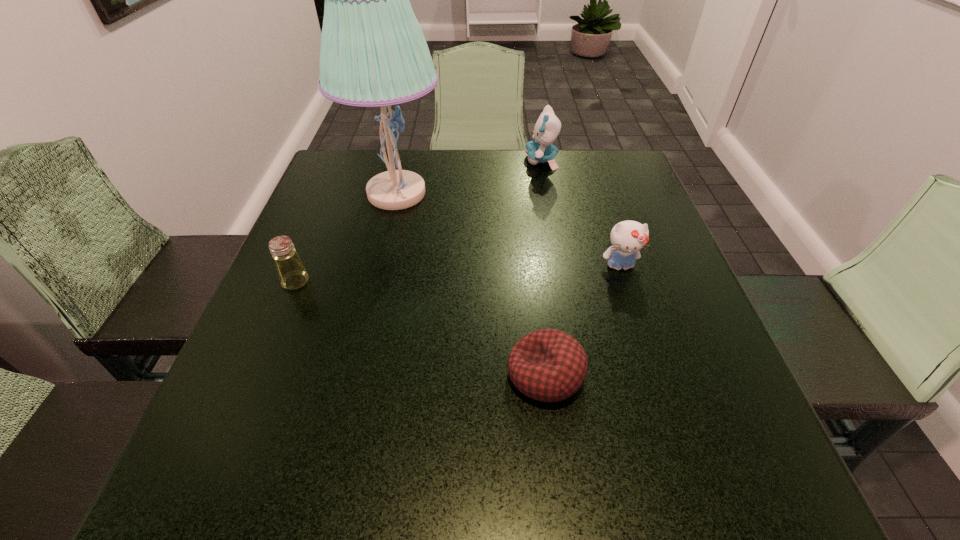
Locate an element on the screen. lamp is located at coordinates (373, 52).

Where is `the second object from left to right`? the second object from left to right is located at coordinates (373, 52).

Find the location of a particular element. the left kitten is located at coordinates (547, 128).

Where is `the farther kitten`? The height and width of the screenshot is (540, 960). the farther kitten is located at coordinates pyautogui.click(x=547, y=128).

At what (x,y) coordinates should I click in order to perform the action: click on the rightmost object. Please return your answer as a coordinate pair (x, y). The image size is (960, 540). Looking at the image, I should click on (628, 238).

You are a GUI agent. You are given a task and a screenshot of the screen. Output one action in this format:
    pyautogui.click(x=<x>, y=<y>)
    Task: Click on the nearer kitten
    The width and height of the screenshot is (960, 540).
    Given the screenshot: What is the action you would take?
    pyautogui.click(x=628, y=238)

Locate an element on the screen. The width and height of the screenshot is (960, 540). the leftmost object is located at coordinates (292, 274).

In order to click on the nearest object in this screenshot , I will do pos(548,365).

Identify the location of beanbag. This screenshot has height=540, width=960. (548, 365).

This screenshot has height=540, width=960. Find the location of `free spot located on the front of the second object from left to right`. free spot located on the front of the second object from left to right is located at coordinates (356, 368).